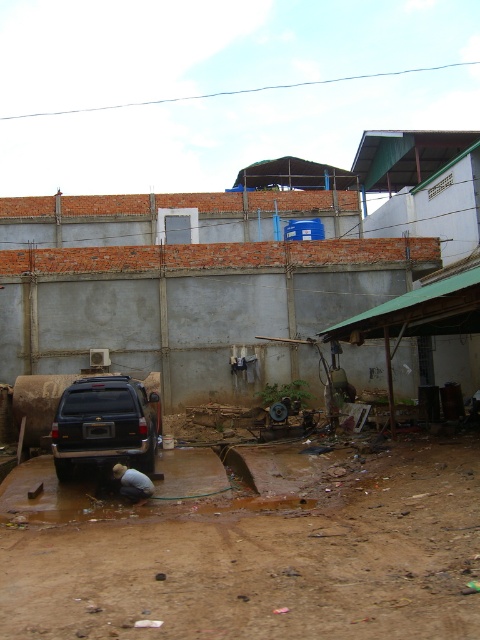
You are driving a delivery truck that is 2 meters wide. You need to navigate through the scene shown. Can your truck pass between the brown dirt track at lower center and the dark blue matte jeep at center?

The brown dirt track at lower center is located below the dark blue matte jeep at center, so the truck cannot pass between them as they are vertically aligned rather than side by side.

You are driving a dark blue matte jeep at center and want to turn around on the brown dirt track at lower center. Is there enough space to do so?

The brown dirt track at lower center might be wider than the dark blue matte jeep at center, so there may be sufficient space to turn around, but it is uncertain due to the comparative width.

You are a delivery driver who needs to turn left onto a main road from the current position. You see a brown dirt track at lower center and a dark blue matte jeep at center. Which object should you avoid to make the left turn safely?

You should avoid the dark blue matte jeep at center because the brown dirt track at lower center is to the right of it, meaning the jeep is blocking the left turn path. Move around the jeep to the right towards the dirt track to safely turn left.